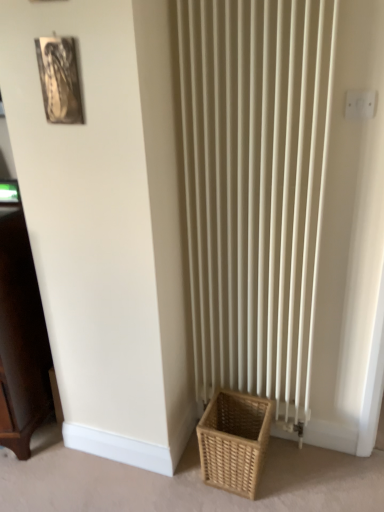
What is the approximate width of white plastic electric outlet at upper right?

0.75 inches.

Identify the location of white plastic electric outlet at upper right. (360, 104).

Where is `natural woven basket at lower right`? natural woven basket at lower right is located at coordinates (234, 441).

The height and width of the screenshot is (512, 384). Describe the element at coordinates (234, 441) in the screenshot. I see `natural woven basket at lower right` at that location.

The width and height of the screenshot is (384, 512). Find the location of `dark wood cabinet at left`. dark wood cabinet at left is located at coordinates (21, 339).

The height and width of the screenshot is (512, 384). Find the location of `picture frame in front of the natural woven basket at lower right`. picture frame in front of the natural woven basket at lower right is located at coordinates (59, 79).

Does metallic silver picture frame at upper left have a larger size compared to natural woven basket at lower right?

No, metallic silver picture frame at upper left is not bigger than natural woven basket at lower right.

Could you tell me if metallic silver picture frame at upper left is facing natural woven basket at lower right?

No, metallic silver picture frame at upper left is not turned towards natural woven basket at lower right.

In the scene shown: Which is more to the right, dark wood cabinet at left or natural woven basket at lower right?

natural woven basket at lower right.

How far apart are dark wood cabinet at left and natural woven basket at lower right?

A distance of 87.50 centimeters exists between dark wood cabinet at left and natural woven basket at lower right.

From a real-world perspective, which is physically above, dark wood cabinet at left or natural woven basket at lower right?

dark wood cabinet at left is physically above.

Is dark wood cabinet at left bigger than metallic silver picture frame at upper left?

Yes, dark wood cabinet at left is bigger than metallic silver picture frame at upper left.

Is dark wood cabinet at left far from metallic silver picture frame at upper left?

No, there isn't a large distance between dark wood cabinet at left and metallic silver picture frame at upper left.

In the image, is dark wood cabinet at left positioned in front of or behind metallic silver picture frame at upper left?

dark wood cabinet at left is behind metallic silver picture frame at upper left.

Does point (24, 312) appear closer or farther from the camera than point (61, 115)?

Clearly, point (24, 312) is more distant from the camera than point (61, 115).

Is white plastic electric outlet at upper right oriented away from natural woven basket at lower right?

white plastic electric outlet at upper right does not have its back to natural woven basket at lower right.

From the image's perspective, which object appears higher, white plastic electric outlet at upper right or natural woven basket at lower right?

white plastic electric outlet at upper right.

Could you measure the distance between white plastic electric outlet at upper right and natural woven basket at lower right?

white plastic electric outlet at upper right is 1.29 meters from natural woven basket at lower right.

Do you think white plastic electric outlet at upper right is within natural woven basket at lower right, or outside of it?

white plastic electric outlet at upper right is not enclosed by natural woven basket at lower right.

You are a GUI agent. You are given a task and a screenshot of the screen. Output one action in this format:
    pyautogui.click(x=<x>, y=<y>)
    Task: Click on the furniture below the white plastic electric outlet at upper right (from the image's perspective)
    
    Given the screenshot: What is the action you would take?
    pyautogui.click(x=21, y=339)

Considering the relative positions of white plastic electric outlet at upper right and dark wood cabinet at left in the image provided, is white plastic electric outlet at upper right to the left or to the right of dark wood cabinet at left?

In the image, white plastic electric outlet at upper right appears on the right side of dark wood cabinet at left.

Find the location of a particular element. picture frame on the left of white plastic electric outlet at upper right is located at coordinates (59, 79).

Is metallic silver picture frame at upper left positioned far away from white plastic electric outlet at upper right?

That's not correct — metallic silver picture frame at upper left is a little close to white plastic electric outlet at upper right.

Is white plastic electric outlet at upper right located within metallic silver picture frame at upper left?

No.

Does metallic silver picture frame at upper left appear on the right side of white plastic electric outlet at upper right?

In fact, metallic silver picture frame at upper left is to the left of white plastic electric outlet at upper right.

Which is more to the right, natural woven basket at lower right or dark wood cabinet at left?

natural woven basket at lower right.

Is natural woven basket at lower right positioned with its back to dark wood cabinet at left?

natural woven basket at lower right does not have its back to dark wood cabinet at left.

Would you say natural woven basket at lower right is a long distance from dark wood cabinet at left?

No, natural woven basket at lower right is in close proximity to dark wood cabinet at left.

The height and width of the screenshot is (512, 384). I want to click on basket below the dark wood cabinet at left (from a real-world perspective), so click(234, 441).

The height and width of the screenshot is (512, 384). Identify the location of basket beneath the metallic silver picture frame at upper left (from a real-world perspective). (234, 441).

Where is `basket below the dark wood cabinet at left (from the image's perspective)`? basket below the dark wood cabinet at left (from the image's perspective) is located at coordinates (234, 441).

Which object lies further to the anchor point white plastic electric outlet at upper right, dark wood cabinet at left or natural woven basket at lower right?

Among the two, dark wood cabinet at left is located further to white plastic electric outlet at upper right.

When comparing their distances from metallic silver picture frame at upper left, does dark wood cabinet at left or natural woven basket at lower right seem further?

Among the two, natural woven basket at lower right is located further to metallic silver picture frame at upper left.

From the image, which object appears to be nearer to white plastic electric outlet at upper right, metallic silver picture frame at upper left or natural woven basket at lower right?

metallic silver picture frame at upper left is positioned closer to the anchor white plastic electric outlet at upper right.

Which object lies further to the anchor point metallic silver picture frame at upper left, white plastic electric outlet at upper right or natural woven basket at lower right?

natural woven basket at lower right.

Looking at the image, which one is located closer to white plastic electric outlet at upper right, metallic silver picture frame at upper left or dark wood cabinet at left?

metallic silver picture frame at upper left is positioned closer to the anchor white plastic electric outlet at upper right.

Estimate the real-world distances between objects in this image. Which object is closer to natural woven basket at lower right, metallic silver picture frame at upper left or dark wood cabinet at left?

Based on the image, dark wood cabinet at left appears to be nearer to natural woven basket at lower right.

Estimate the real-world distances between objects in this image. Which object is closer to dark wood cabinet at left, metallic silver picture frame at upper left or white plastic electric outlet at upper right?

Among the two, metallic silver picture frame at upper left is located nearer to dark wood cabinet at left.

Looking at this image, from the image, which object appears to be farther from white plastic electric outlet at upper right, natural woven basket at lower right or dark wood cabinet at left?

dark wood cabinet at left is positioned further to the anchor white plastic electric outlet at upper right.

Locate an element on the screen. This screenshot has width=384, height=512. picture frame between dark wood cabinet at left and white plastic electric outlet at upper right is located at coordinates (59, 79).

Find the location of a particular element. The height and width of the screenshot is (512, 384). electric outlet between metallic silver picture frame at upper left and natural woven basket at lower right vertically is located at coordinates (360, 104).

The image size is (384, 512). I want to click on furniture between metallic silver picture frame at upper left and natural woven basket at lower right in the up-down direction, so click(x=21, y=339).

This screenshot has width=384, height=512. Find the location of `basket located between dark wood cabinet at left and white plastic electric outlet at upper right in the left-right direction`. basket located between dark wood cabinet at left and white plastic electric outlet at upper right in the left-right direction is located at coordinates (234, 441).